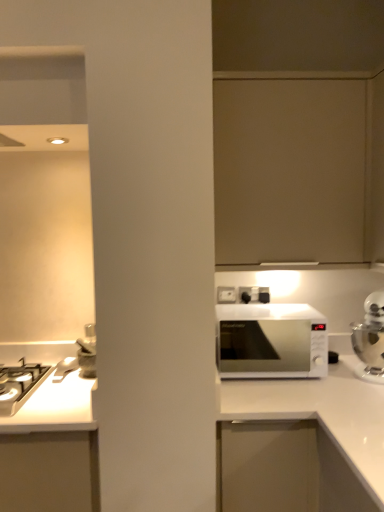
What is the approximate height of white plastic electric outlet at upper center?

3.27 inches.

This screenshot has height=512, width=384. What do you see at coordinates (226, 295) in the screenshot? I see `white plastic electric outlet at upper center` at bounding box center [226, 295].

Where is `silver metallic kettle at right`? The image size is (384, 512). silver metallic kettle at right is located at coordinates (371, 337).

Where is `white glossy microwave at center`? This screenshot has width=384, height=512. white glossy microwave at center is located at coordinates (271, 341).

From a real-world perspective, between white plastic electric outlet at upper center and white glossy gas stove at left, who is vertically higher?

white plastic electric outlet at upper center.

Looking at their sizes, would you say white plastic electric outlet at upper center is wider or thinner than white glossy gas stove at left?

white plastic electric outlet at upper center is thinner than white glossy gas stove at left.

How far apart are white plastic electric outlet at upper center and white glossy gas stove at left?

The distance of white plastic electric outlet at upper center from white glossy gas stove at left is 35.43 inches.

Is white plastic electric outlet at upper center positioned before white glossy gas stove at left?

No, white plastic electric outlet at upper center is further to the viewer.

Considering the relative sizes of matte beige cabinet at upper center and white glossy microwave at center in the image provided, is matte beige cabinet at upper center smaller than white glossy microwave at center?

Actually, matte beige cabinet at upper center might be larger than white glossy microwave at center.

Between matte beige cabinet at upper center and white glossy microwave at center, which one appears on the left side from the viewer's perspective?

From the viewer's perspective, white glossy microwave at center appears more on the left side.

Could you tell me if matte beige cabinet at upper center is turned towards white glossy microwave at center?

No, matte beige cabinet at upper center is not turned towards white glossy microwave at center.

Can you tell me how much matte beige cabinet at upper center and white glossy microwave at center differ in facing direction?

The facing directions of matte beige cabinet at upper center and white glossy microwave at center are 0.0528 degrees apart.

From the image's perspective, is white glossy microwave at center located above or below white plastic electric outlet at upper center?

white glossy microwave at center is situated lower than white plastic electric outlet at upper center in the image.

Is white glossy microwave at center further to camera compared to white plastic electric outlet at upper center?

No, white glossy microwave at center is closer to the viewer.

Which object is positioned more to the left, white glossy microwave at center or white plastic electric outlet at upper center?

white plastic electric outlet at upper center.

Measure the distance between white glossy microwave at center and white plastic electric outlet at upper center.

A distance of 12.38 inches exists between white glossy microwave at center and white plastic electric outlet at upper center.

What's the angular difference between white glossy gas stove at left and matte beige cabinet at upper center's facing directions?

0.153 degrees separate the facing orientations of white glossy gas stove at left and matte beige cabinet at upper center.

Which object is wider, white glossy gas stove at left or matte beige cabinet at upper center?

white glossy gas stove at left is wider.

Which is behind, white glossy gas stove at left or matte beige cabinet at upper center?

matte beige cabinet at upper center is more distant.

Consider the image. From a real-world perspective, which object rests below the other?

From a 3D spatial view, white glossy gas stove at left is below.

Which point is more distant from viewer, (16,380) or (231,290)?

The point (231,290) is behind.

Is white glossy gas stove at left facing away from white plastic electric outlet at upper center?

No.

Considering the sizes of objects white glossy gas stove at left and white plastic electric outlet at upper center in the image provided, who is thinner, white glossy gas stove at left or white plastic electric outlet at upper center?

With smaller width is white plastic electric outlet at upper center.

From the image's perspective, would you say white glossy microwave at right is positioned over matte beige cabinet at upper center?

No, from the image's perspective, white glossy microwave at right is not on top of matte beige cabinet at upper center.

Looking at their sizes, would you say white glossy microwave at right is wider or thinner than matte beige cabinet at upper center?

Considering their sizes, white glossy microwave at right looks broader than matte beige cabinet at upper center.

From a real-world perspective, is white glossy microwave at right physically below matte beige cabinet at upper center?

Correct, in the physical world, white glossy microwave at right is lower than matte beige cabinet at upper center.

Which object is positioned more to the left, white glossy microwave at right or white glossy microwave at center?

Positioned to the left is white glossy microwave at center.

Looking at this image, from a real-world perspective, is white glossy microwave at right on white glossy microwave at center?

Incorrect, from a real-world perspective, white glossy microwave at right is lower than white glossy microwave at center.

Considering the sizes of white glossy microwave at right and white glossy microwave at center in the image, is white glossy microwave at right taller or shorter than white glossy microwave at center?

In the image, white glossy microwave at right appears to be taller than white glossy microwave at center.

At what (x,y) coordinates should I click in order to perform the action: click on electric outlet that appears behind the white glossy gas stove at left. Please return your answer as a coordinate pair (x, y). This screenshot has height=512, width=384. Looking at the image, I should click on (226, 295).

In the image, there is a matte beige cabinet at upper center. What are the coordinates of `microwave oven below it (from a real-world perspective)` in the screenshot? It's located at (271, 341).

From the image, which object appears to be nearer to white glossy microwave at right, matte beige cabinet at upper center or white plastic electric outlet at upper center?

white plastic electric outlet at upper center is closer to white glossy microwave at right.

Looking at the image, which one is located closer to white glossy microwave at right, white plastic electric outlet at upper center or white glossy gas stove at left?

white plastic electric outlet at upper center is positioned closer to the anchor white glossy microwave at right.

Looking at the image, which one is located further to white glossy microwave at center, white glossy gas stove at left or silver metallic kettle at right?

white glossy gas stove at left.

Based on their spatial positions, is white glossy gas stove at left or silver metallic kettle at right closer to matte beige cabinet at upper center?

The object closer to matte beige cabinet at upper center is silver metallic kettle at right.

Based on their spatial positions, is silver metallic kettle at right or matte beige cabinet at upper center closer to white glossy microwave at center?

silver metallic kettle at right is closer to white glossy microwave at center.

Estimate the real-world distances between objects in this image. Which object is further from white glossy gas stove at left, white glossy microwave at right or matte beige cabinet at upper center?

matte beige cabinet at upper center.

From the image, which object appears to be nearer to silver metallic kettle at right, white glossy gas stove at left or white glossy microwave at right?

white glossy microwave at right is closer to silver metallic kettle at right.

Based on the photo, which object lies nearer to the anchor point white glossy microwave at center, white glossy microwave at right or matte beige cabinet at upper center?

Among the two, white glossy microwave at right is located nearer to white glossy microwave at center.

This screenshot has height=512, width=384. I want to click on cabinetry located between white glossy gas stove at left and silver metallic kettle at right in the left-right direction, so click(x=299, y=170).

At what (x,y) coordinates should I click in order to perform the action: click on electric outlet between white glossy gas stove at left and matte beige cabinet at upper center in the horizontal direction. Please return your answer as a coordinate pair (x, y). Looking at the image, I should click on (226, 295).

I want to click on microwave oven between white glossy gas stove at left and white glossy microwave at right from left to right, so click(x=271, y=341).

Identify the location of microwave oven between matte beige cabinet at upper center and white glossy microwave at right in the up-down direction. This screenshot has height=512, width=384. (271, 341).